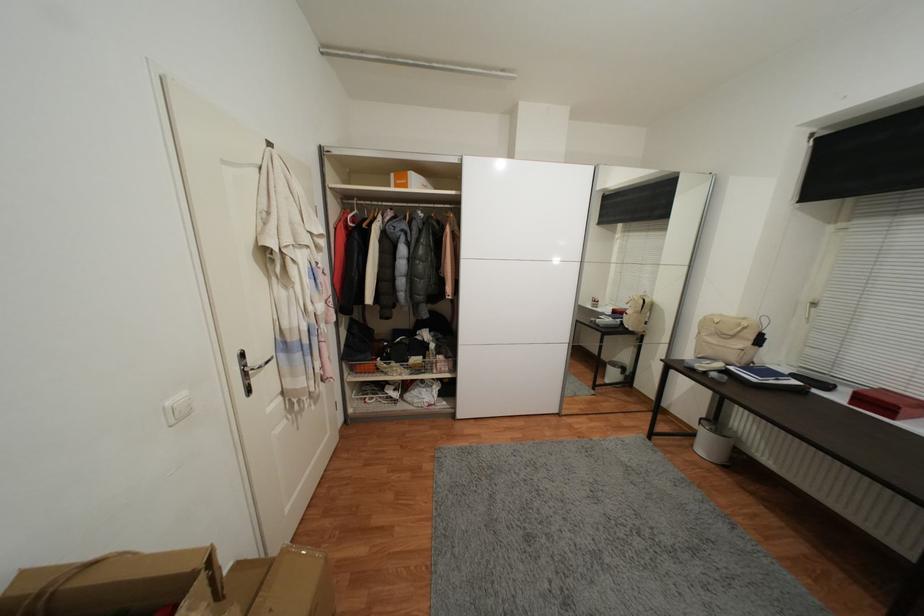
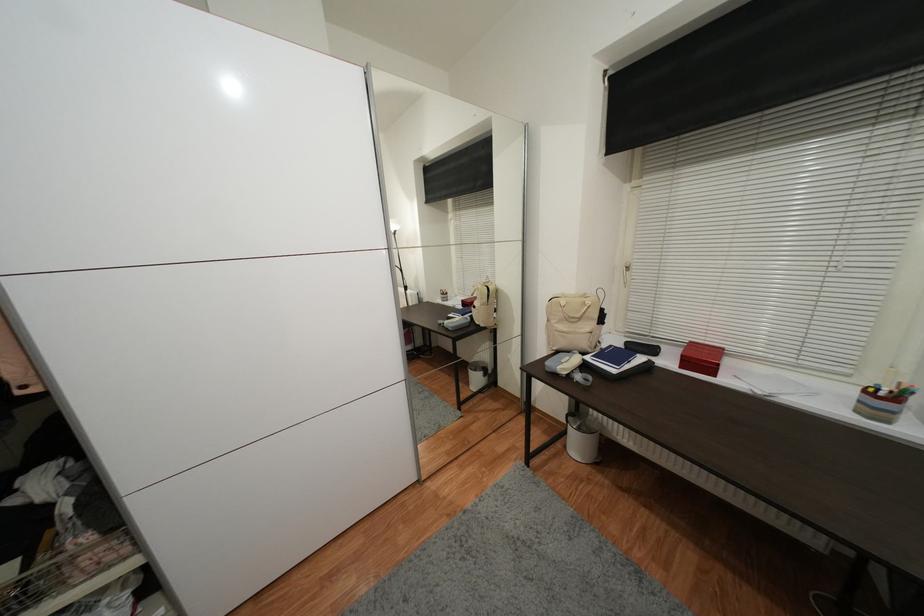
Locate, in the second image, the point that corresponds to the point at 697,447 in the first image.

(569, 448)